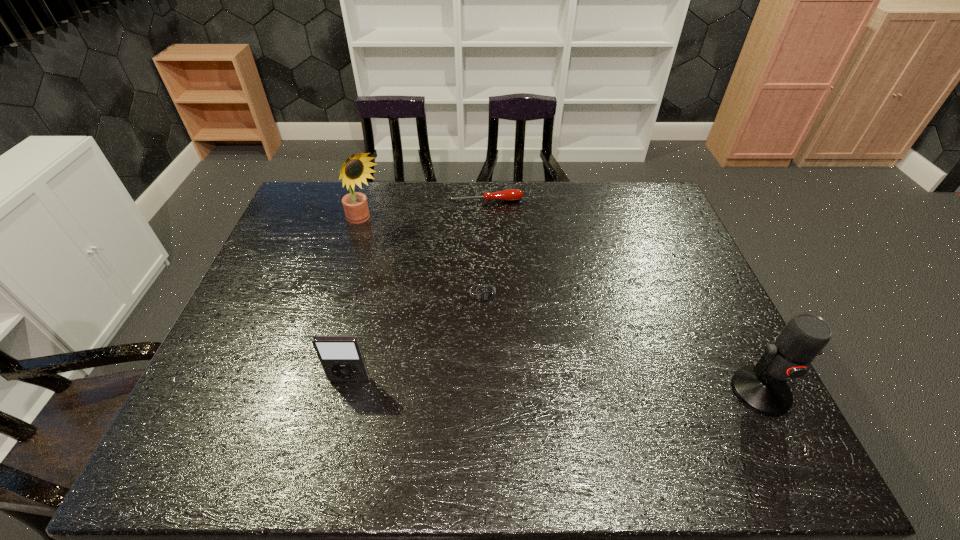
Locate an element on the screen. Image resolution: width=960 pixels, height=540 pixels. free space between the second farthest object and the iPod is located at coordinates (358, 301).

You are a GUI agent. You are given a task and a screenshot of the screen. Output one action in this format:
    pyautogui.click(x=<x>, y=<y>)
    Task: Click on the empty space between the shortest object and the rightmost object
    The width and height of the screenshot is (960, 540).
    Given the screenshot: What is the action you would take?
    pyautogui.click(x=623, y=342)

Locate an element on the screen. vacant area that lies between the third shortest object and the watch is located at coordinates (418, 337).

Locate an element on the screen. vacant space that is in between the sunflower and the third shortest object is located at coordinates (358, 301).

At what (x,y) coordinates should I click in order to perform the action: click on unoccupied area between the farthest object and the microphone. Please return your answer as a coordinate pair (x, y). This screenshot has height=540, width=960. Looking at the image, I should click on (623, 296).

Identify the location of empty location between the fourth nearest object and the microphone. (563, 307).

You are a GUI agent. You are given a task and a screenshot of the screen. Output one action in this format:
    pyautogui.click(x=<x>, y=<y>)
    Task: Click on the free space between the rightmost object and the watch
    The width and height of the screenshot is (960, 540).
    Given the screenshot: What is the action you would take?
    pyautogui.click(x=623, y=342)

Locate an element on the screen. free space between the sunflower and the screwdriver is located at coordinates (425, 211).

At what (x,y) coordinates should I click in order to perform the action: click on unoccupied position between the microphone and the third farthest object. Please return your answer as a coordinate pair (x, y). Looking at the image, I should click on (623, 342).

This screenshot has height=540, width=960. What are the coordinates of `object that is the closest one to the shortest object` in the screenshot? It's located at (342, 359).